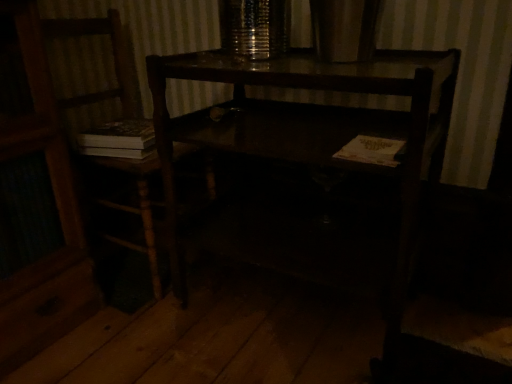
Question: Considering the positions of white paper book at lower right and wooden chair at left in the image, is white paper book at lower right wider or thinner than wooden chair at left?

Choices:
 (A) wide
 (B) thin

Answer: (B)

Question: In terms of size, does white paper book at lower right appear bigger or smaller than wooden chair at left?

Choices:
 (A) big
 (B) small

Answer: (B)

Question: Which is nearer to the wooden chair at left?

Choices:
 (A) dark wood desk at center
 (B) white paper book at lower right

Answer: (A)

Question: Which is nearer to the wooden chair at left?

Choices:
 (A) dark wood desk at center
 (B) white paper book at lower right

Answer: (A)